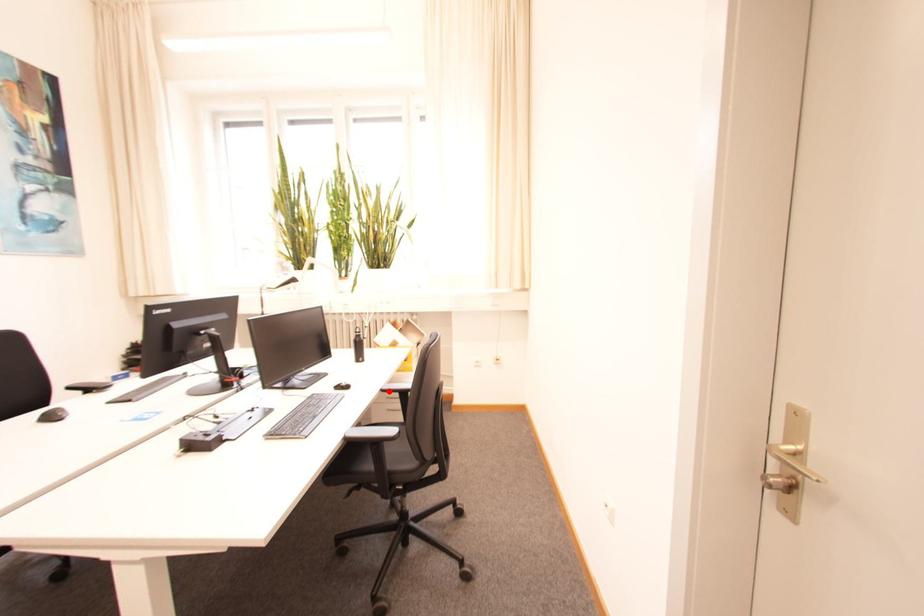
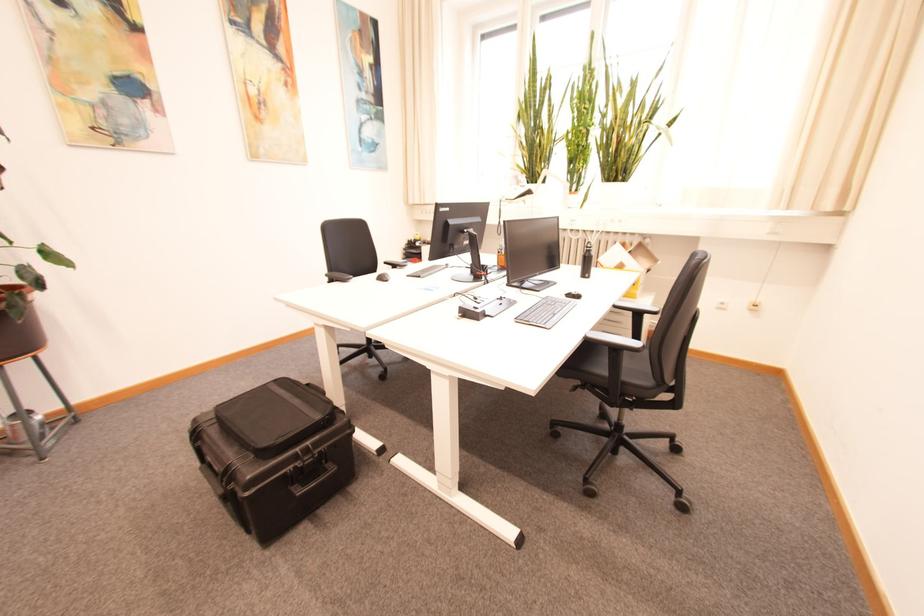
The point at the highlighted location is marked in the first image. Where is the corresponding point in the second image?

(622, 308)